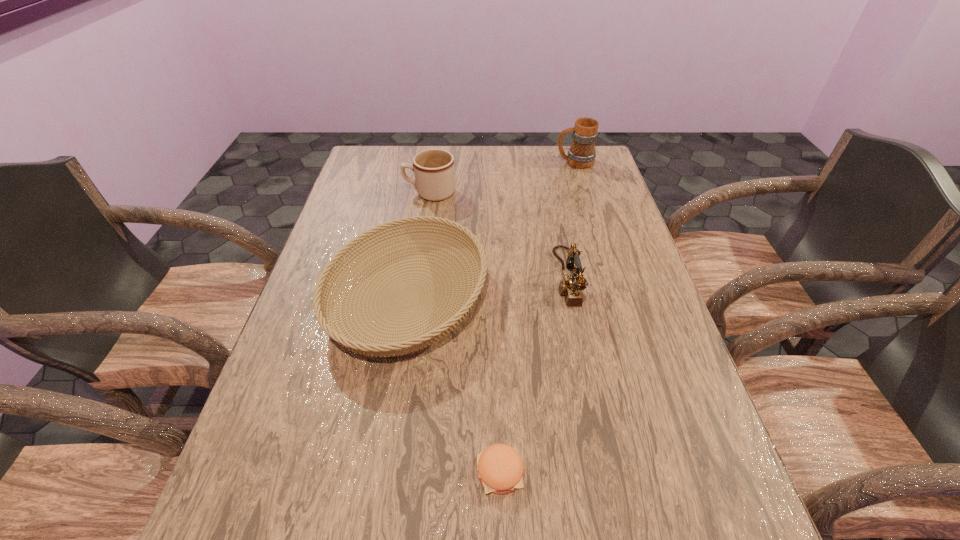
In order to click on the farthest object in this screenshot , I will do `click(581, 154)`.

Find the location of `the rightmost object`. the rightmost object is located at coordinates (581, 154).

Identify the location of the nearer mug. The width and height of the screenshot is (960, 540). (434, 169).

What are the coordinates of `the shorter mug` in the screenshot? It's located at (434, 169).

Locate an element on the screen. This screenshot has width=960, height=540. the fourth object from left to right is located at coordinates (570, 286).

Where is `basket`? This screenshot has height=540, width=960. basket is located at coordinates (463, 303).

This screenshot has width=960, height=540. Find the location of `the shortest object`. the shortest object is located at coordinates (500, 468).

Find the location of `the nearest object`. the nearest object is located at coordinates (500, 468).

Identify the location of free point located 0.350m on the side of the farthest object with the handle. This screenshot has width=960, height=540. (456, 162).

Image resolution: width=960 pixels, height=540 pixels. What are the coordinates of `vacant space positioned on the side of the farthest object with the handle` in the screenshot? It's located at (450, 162).